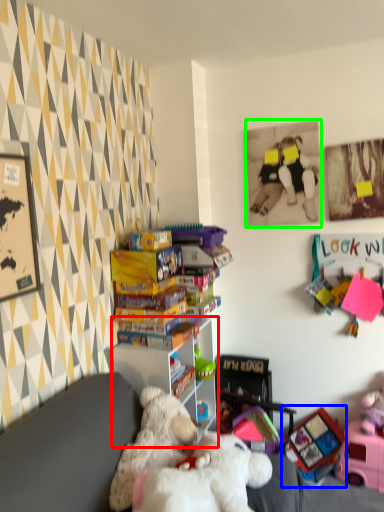
Question: Which object is positioned farthest from shelf (highlighted by a red box)? Select from toy (highlighted by a blue box) and picture frame (highlighted by a green box).

Choices:
 (A) toy
 (B) picture frame

Answer: (B)